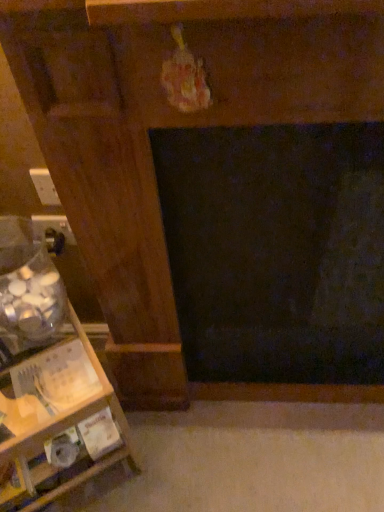
Question: Is white plastic electric outlet at left, which is the second electric outlet in back-to-front order, completely or partially outside of wooden shelf at left?

Choices:
 (A) no
 (B) yes

Answer: (B)

Question: Is the position of white plastic electric outlet at left, placed as the first electric outlet when sorted from top to bottom, more distant than that of wooden shelf at left?

Choices:
 (A) yes
 (B) no

Answer: (A)

Question: Is white plastic electric outlet at left, which is the second electric outlet in back-to-front order, taller than wooden shelf at left?

Choices:
 (A) no
 (B) yes

Answer: (A)

Question: From the image's perspective, is white plastic electric outlet at left, which is the first electric outlet from front to back, beneath wooden shelf at left?

Choices:
 (A) no
 (B) yes

Answer: (A)

Question: Can wooden shelf at left be found inside white plastic electric outlet at left, which is the second electric outlet in back-to-front order?

Choices:
 (A) no
 (B) yes

Answer: (A)

Question: From a real-world perspective, is white plastic electric outlet at left, marked as the second electric outlet in a bottom-to-top arrangement, above or below matte black outlet at lower left, which ranks as the first electric outlet in bottom-to-top order?

Choices:
 (A) above
 (B) below

Answer: (A)

Question: Looking at the image, does white plastic electric outlet at left, which is the second electric outlet in back-to-front order, seem bigger or smaller compared to matte black outlet at lower left, the first electric outlet when ordered from back to front?

Choices:
 (A) big
 (B) small

Answer: (B)

Question: From the image's perspective, is white plastic electric outlet at left, placed as the first electric outlet when sorted from top to bottom, above or below matte black outlet at lower left, the 2th electric outlet viewed from the front?

Choices:
 (A) above
 (B) below

Answer: (A)

Question: From their relative heights in the image, would you say white plastic electric outlet at left, which is the second electric outlet in back-to-front order, is taller or shorter than matte black outlet at lower left, the first electric outlet when ordered from back to front?

Choices:
 (A) tall
 (B) short

Answer: (A)

Question: From the image's perspective, is white plastic electric outlet at left, marked as the second electric outlet in a bottom-to-top arrangement, located above or below wooden shelf at left?

Choices:
 (A) below
 (B) above

Answer: (B)

Question: Does point 46,188 appear closer or farther from the camera than point 46,349?

Choices:
 (A) closer
 (B) farther

Answer: (B)

Question: From a real-world perspective, is white plastic electric outlet at left, marked as the second electric outlet in a bottom-to-top arrangement, physically located above or below wooden shelf at left?

Choices:
 (A) below
 (B) above

Answer: (B)

Question: In terms of height, does white plastic electric outlet at left, which is the second electric outlet in back-to-front order, look taller or shorter compared to wooden shelf at left?

Choices:
 (A) short
 (B) tall

Answer: (A)

Question: Is matte black outlet at lower left, the first electric outlet when ordered from back to front, inside the boundaries of white plastic electric outlet at left, placed as the first electric outlet when sorted from top to bottom, or outside?

Choices:
 (A) inside
 (B) outside

Answer: (B)

Question: Looking at their shapes, would you say matte black outlet at lower left, the 2th electric outlet viewed from the front, is wider or thinner than white plastic electric outlet at left, which is the first electric outlet from front to back?

Choices:
 (A) wide
 (B) thin

Answer: (A)